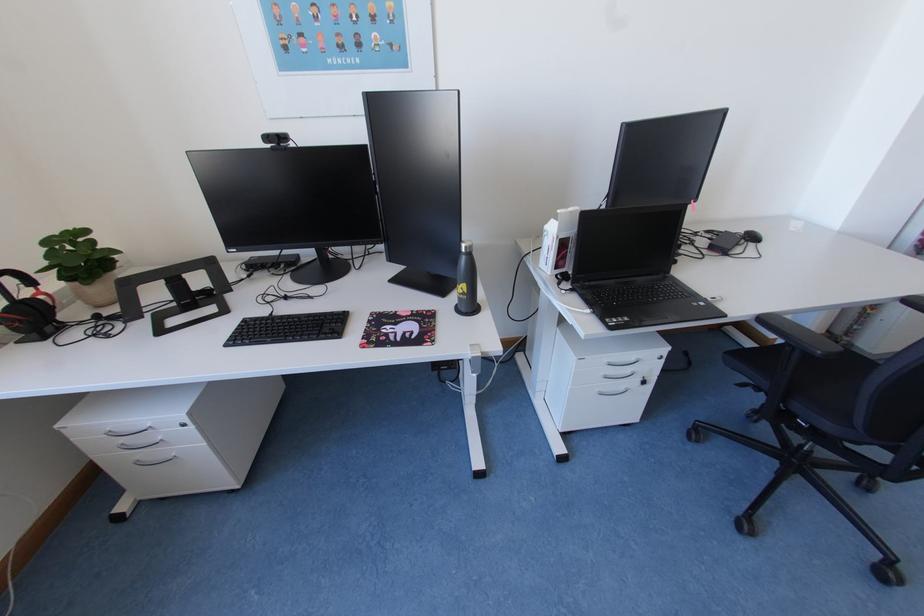
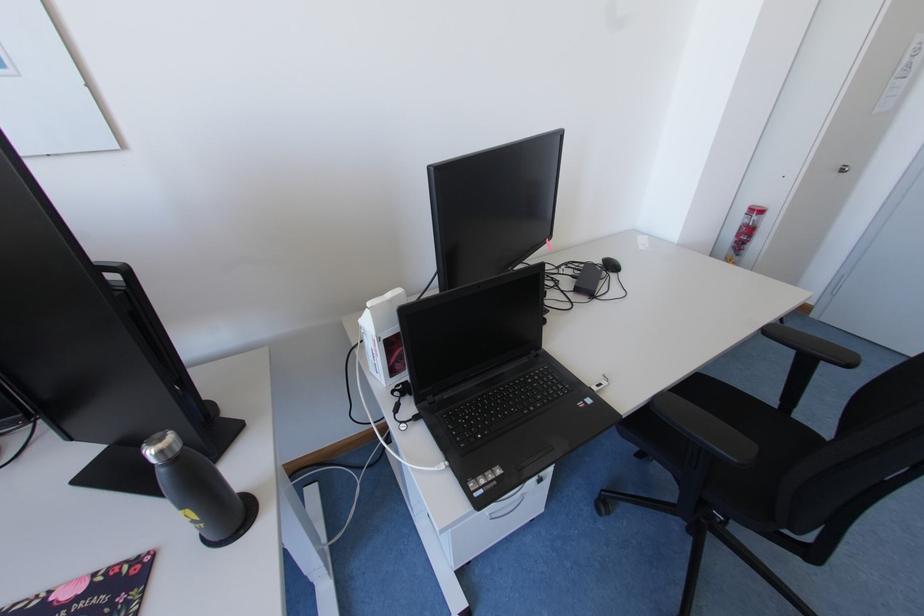
Question: The camera is either moving clockwise (left) or counter-clockwise (right) around the object. The first image is from the beginning of the video and the second image is from the end. Is the camera moving left or right when shooting the video?

Choices:
 (A) Left
 (B) Right

Answer: (A)